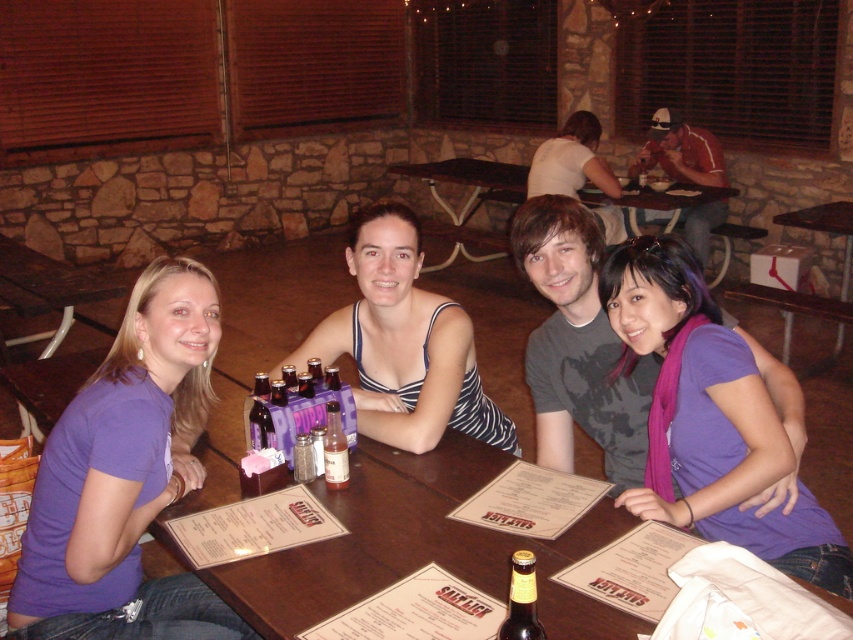
Question: Can you confirm if purple cotton shirt at center is positioned to the right of striped fabric tank top at center?

Choices:
 (A) no
 (B) yes

Answer: (A)

Question: Which object is the farthest from the purple cotton shirt at center?

Choices:
 (A) striped fabric tank top at center
 (B) purple matte beer bottles at center
 (C) purple soft scarf at center

Answer: (C)

Question: Is wooden table at center below purple matte beer bottles at center?

Choices:
 (A) no
 (B) yes

Answer: (A)

Question: Where is purple cotton shirt at center located in relation to striped fabric tank top at center in the image?

Choices:
 (A) left
 (B) right

Answer: (A)

Question: Among these objects, which one is nearest to the camera?

Choices:
 (A) purple matte beer bottles at center
 (B) translucent plastic bottle at table center

Answer: (B)

Question: Which of the following is the farthest from the observer?

Choices:
 (A) matte white tank top at upper center
 (B) translucent plastic bottle at table center

Answer: (A)